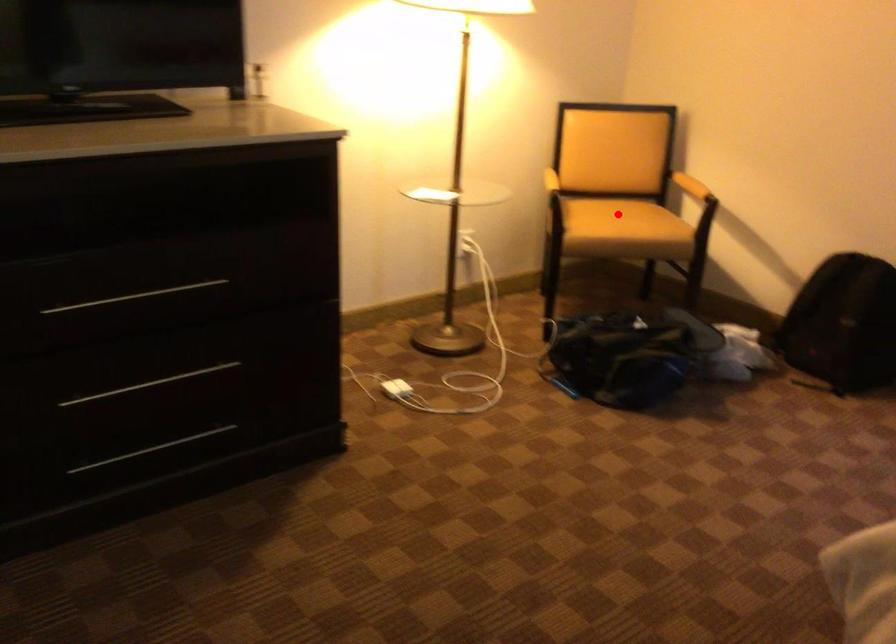
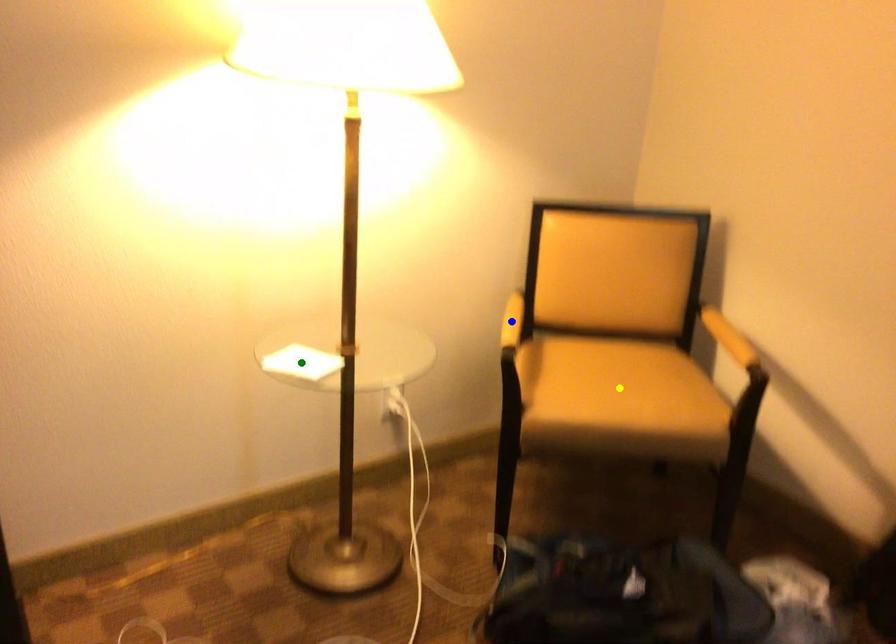
Question: I am providing you with two images of the same scene from different viewpoints. A red point is marked on the first image. You are given multiple points on the second image. Which mark in image 2 goes with the point in image 1?

Choices:
 (A) blue point
 (B) yellow point
 (C) green point

Answer: (B)